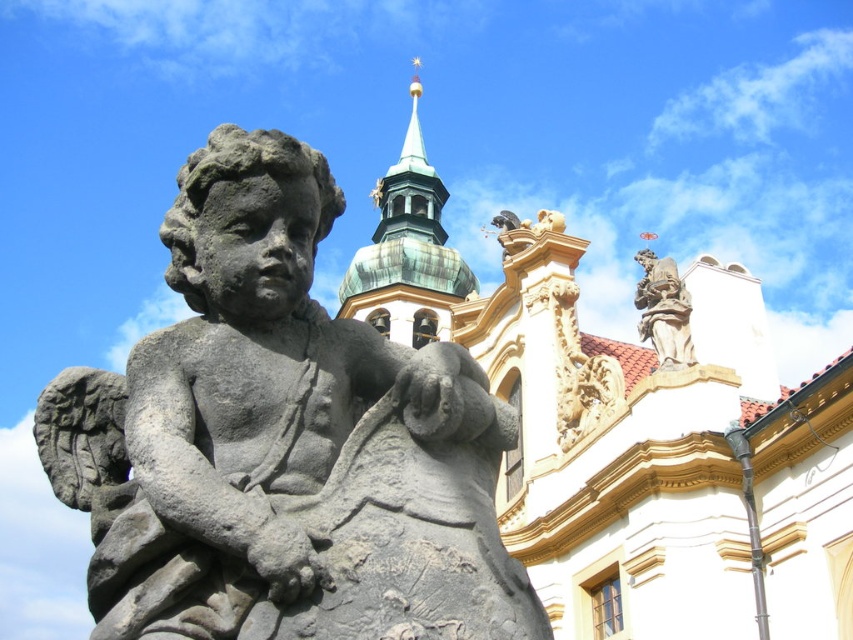
Question: Which point is closer to the camera taking this photo?

Choices:
 (A) (383, 182)
 (B) (524, 620)

Answer: (B)

Question: Can you confirm if green copper tower at upper center is positioned to the right of stone statue at upper right?

Choices:
 (A) no
 (B) yes

Answer: (A)

Question: Which object is closer to the camera taking this photo?

Choices:
 (A) gray stone statue at center
 (B) green copper tower at upper center
 (C) stone statue at upper right

Answer: (A)

Question: Can you confirm if gray stone statue at center is bigger than stone statue at upper right?

Choices:
 (A) no
 (B) yes

Answer: (B)

Question: Does green copper tower at upper center come behind stone statue at upper right?

Choices:
 (A) yes
 (B) no

Answer: (A)

Question: Which point is closer to the camera?

Choices:
 (A) stone statue at upper right
 (B) gray stone statue at center
 (C) green copper tower at upper center

Answer: (B)